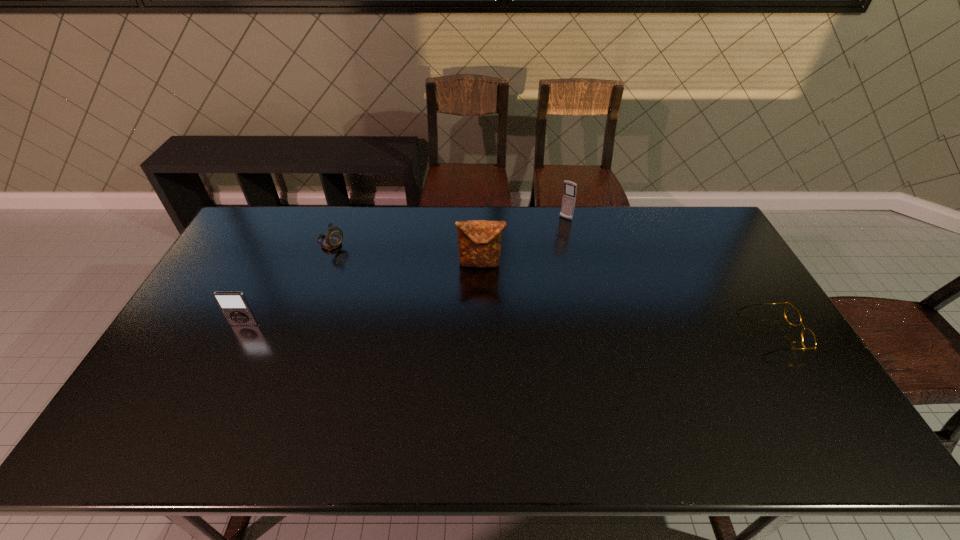
Locate an element on the screen. blank region between the cellular telephone and the fourth tallest object is located at coordinates (447, 232).

Locate an element on the screen. Image resolution: width=960 pixels, height=540 pixels. empty space between the iPod and the compass is located at coordinates (287, 285).

Image resolution: width=960 pixels, height=540 pixels. What are the coordinates of `free space between the rightmost object and the third object from left to right` in the screenshot? It's located at (627, 299).

This screenshot has width=960, height=540. Find the location of `unoccupied position between the third nearest object and the fourth object from right to left`. unoccupied position between the third nearest object and the fourth object from right to left is located at coordinates (405, 254).

Identify the location of free space between the shortest object and the second farthest object. This screenshot has width=960, height=540. (552, 289).

You are a GUI agent. You are given a task and a screenshot of the screen. Output one action in this format:
    pyautogui.click(x=<x>, y=<y>)
    Task: Click on the free area in between the fourth object from right to left and the farthest object
    Image resolution: width=960 pixels, height=540 pixels.
    Given the screenshot: What is the action you would take?
    pyautogui.click(x=447, y=232)

I want to click on free space between the farthest object and the iPod, so click(x=405, y=272).

Where is `free space between the fourth tallest object and the third farthest object`? This screenshot has height=540, width=960. free space between the fourth tallest object and the third farthest object is located at coordinates (405, 254).

Locate an element on the screen. Image resolution: width=960 pixels, height=540 pixels. empty space between the leftmost object and the cellular telephone is located at coordinates (405, 272).

Where is `object that is the third nearest to the third object from left to right`? This screenshot has width=960, height=540. object that is the third nearest to the third object from left to right is located at coordinates (234, 305).